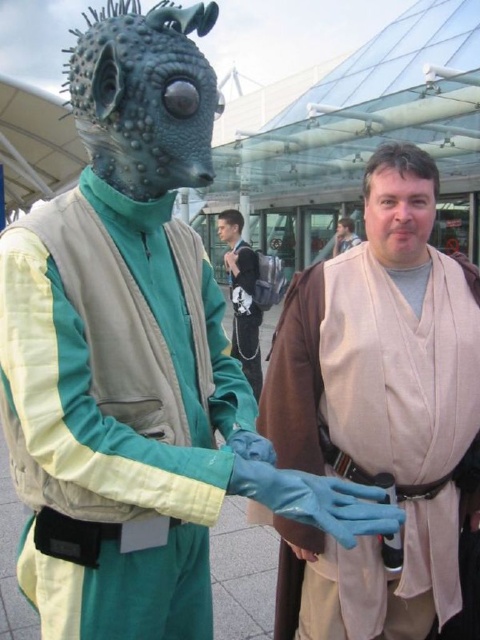
Question: Can you confirm if beige fabric robe at center is positioned to the left of green matte vest at center?

Choices:
 (A) yes
 (B) no

Answer: (B)

Question: Which object is closer to the camera taking this photo?

Choices:
 (A) beige fabric robe at center
 (B) green matte vest at center

Answer: (B)

Question: Does green matte vest at center come in front of light brown leather jacket at center?

Choices:
 (A) no
 (B) yes

Answer: (B)

Question: Observing the image, what is the correct spatial positioning of green matte vest at center in reference to light brown leather jacket at center?

Choices:
 (A) left
 (B) right

Answer: (A)

Question: Which point appears farthest from the camera in this image?

Choices:
 (A) (299, 406)
 (B) (238, 228)

Answer: (B)

Question: Which point is farther to the camera?

Choices:
 (A) light brown leather jacket at center
 (B) green matte vest at center
 (C) beige fabric robe at center

Answer: (A)